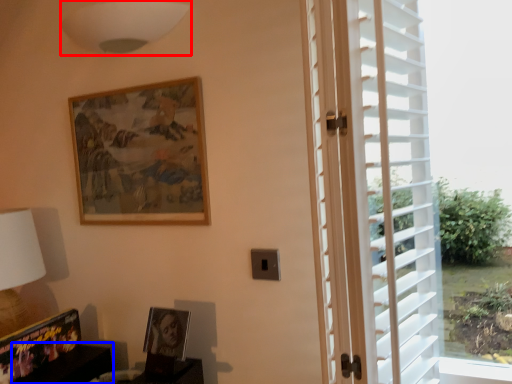
Question: Which point is closer to the camera, lamp (highlighted by a red box) or furniture (highlighted by a blue box)?

Choices:
 (A) lamp
 (B) furniture

Answer: (A)